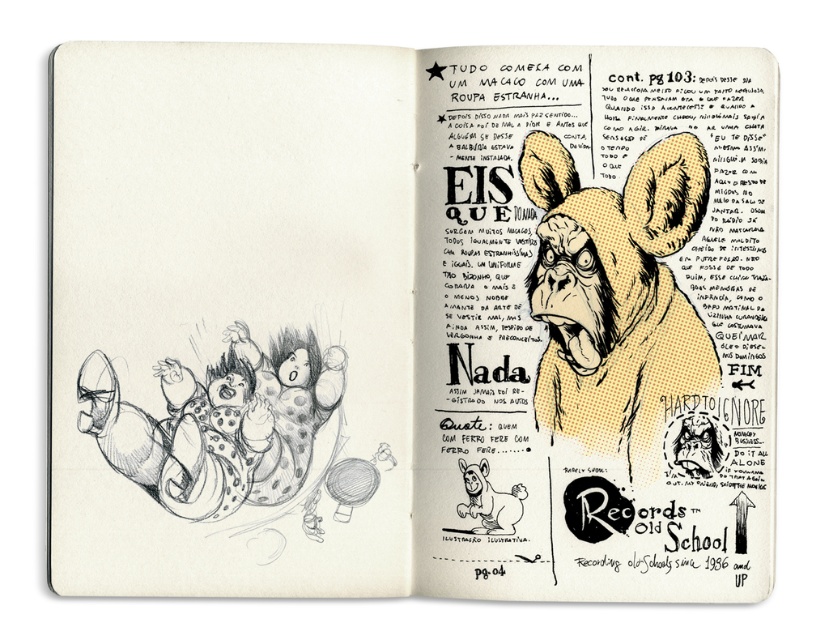
Looking at this image, between yellow dotted fabric monkey at upper right and black and white sketch of children at left, which one has less height?

black and white sketch of children at left is shorter.

Which is more to the left, yellow dotted fabric monkey at upper right or black and white sketch of children at left?

Positioned to the left is black and white sketch of children at left.

Is point (599, 362) behind point (308, 401)?

Yes, point (599, 362) is farther from viewer.

At what (x,y) coordinates should I click in order to perform the action: click on yellow dotted fabric monkey at upper right. Please return your answer as a coordinate pair (x, y). Looking at the image, I should click on (616, 298).